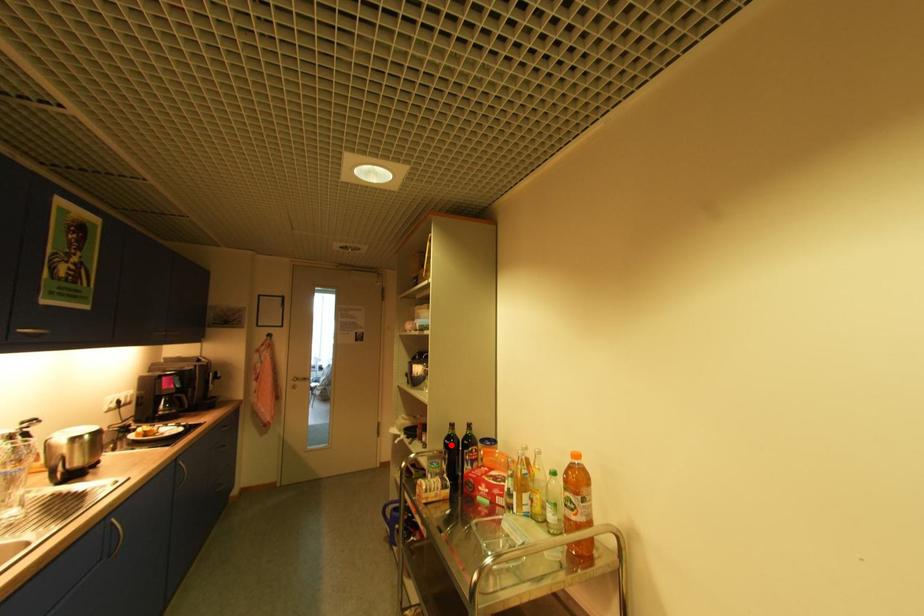
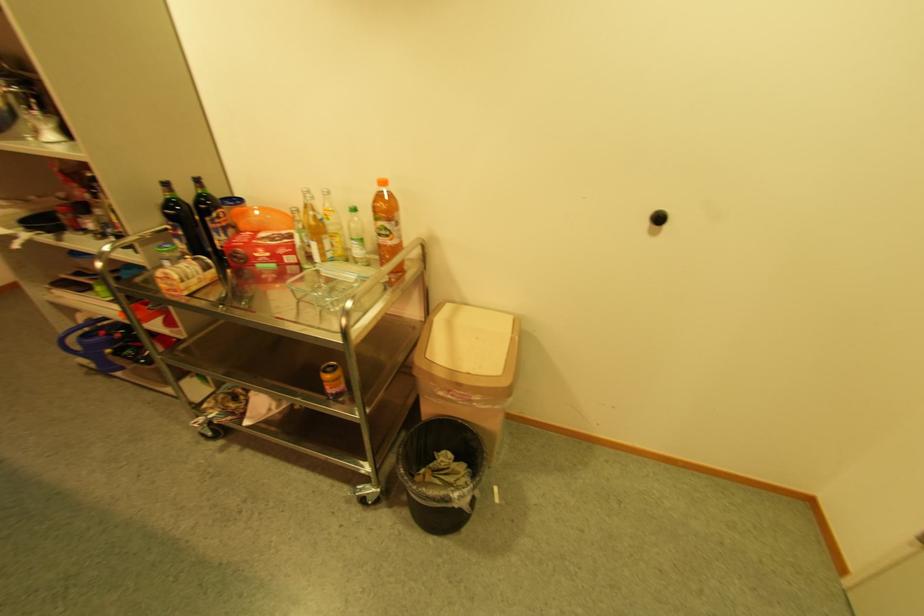
In the second image, find the point that corresponds to the highlighted location in the first image.

(172, 217)